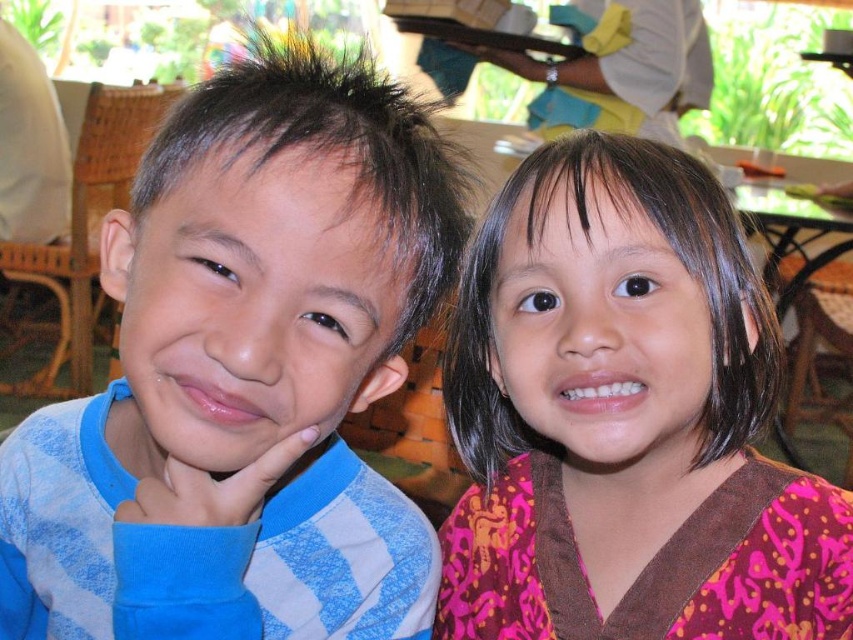
Is blue striped shirt at left behind pink fabric at upper right?

No, it is in front of pink fabric at upper right.

Which is in front, point (102, 493) or point (621, 244)?

Point (621, 244)

The image size is (853, 640). Find the location of `blue striped shirt at left`. blue striped shirt at left is located at coordinates click(245, 378).

Locate an element on the screen. This screenshot has width=853, height=640. pink fabric at upper right is located at coordinates (625, 419).

Image resolution: width=853 pixels, height=640 pixels. What do you see at coordinates (625, 419) in the screenshot?
I see `pink fabric at upper right` at bounding box center [625, 419].

What do you see at coordinates (625, 419) in the screenshot? The height and width of the screenshot is (640, 853). I see `pink fabric at upper right` at bounding box center [625, 419].

Find the location of a particular element. pink fabric at upper right is located at coordinates (625, 419).

Can you confirm if blue striped shirt at left is wider than white cloth at upper center?

Incorrect, blue striped shirt at left's width does not surpass white cloth at upper center's.

Can you confirm if blue striped shirt at left is shorter than white cloth at upper center?

Yes, blue striped shirt at left is shorter than white cloth at upper center.

Who is more forward, [281,116] or [653,109]?

Point [281,116]

Locate an element on the screen. Image resolution: width=853 pixels, height=640 pixels. blue striped shirt at left is located at coordinates (245, 378).